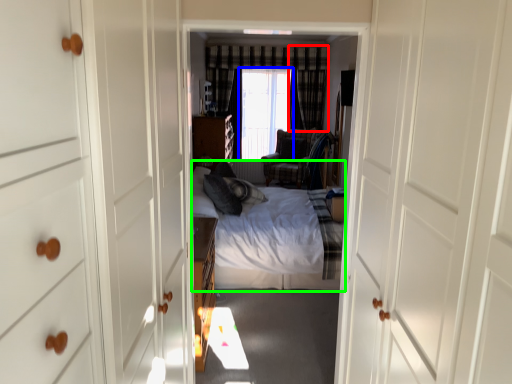
Question: Estimate the real-world distances between objects in this image. Which object is closer to curtain (highlighted by a red box), window screen (highlighted by a blue box) or bed (highlighted by a green box)?

Choices:
 (A) window screen
 (B) bed

Answer: (A)